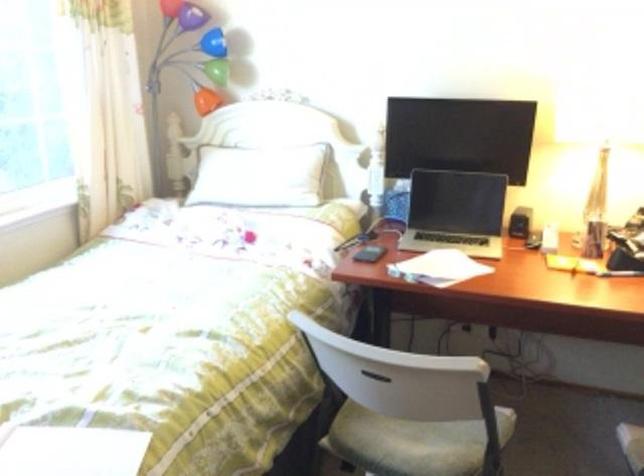
Find the location of a particular element. The height and width of the screenshot is (476, 644). green lamp head is located at coordinates (216, 70).